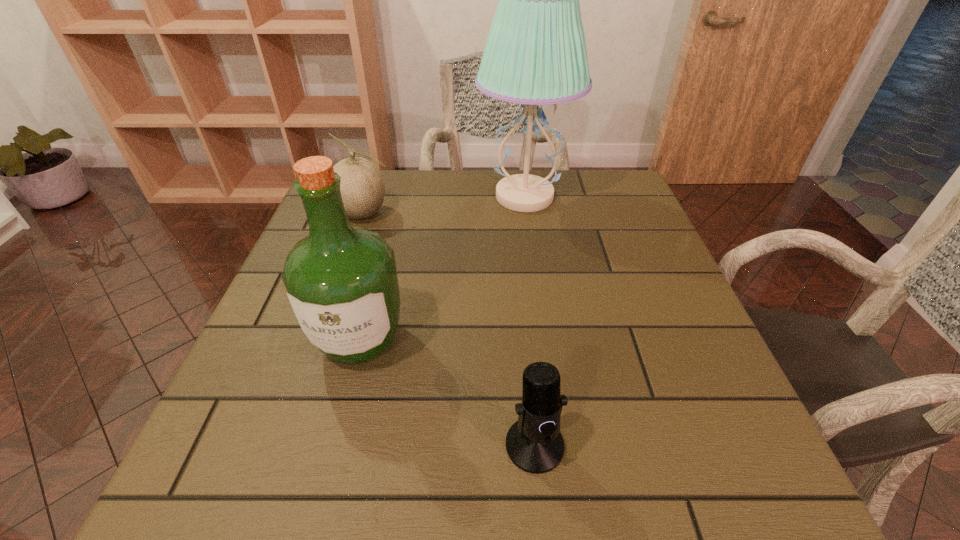
Identify the location of object that is at the near edge. (534, 444).

This screenshot has height=540, width=960. In order to click on liquor located in the left edge section of the desktop in this screenshot , I will do `click(341, 280)`.

This screenshot has height=540, width=960. Find the location of `cantaloup situated at the left edge`. cantaloup situated at the left edge is located at coordinates (x=362, y=186).

Where is `object that is at the far left corner`? object that is at the far left corner is located at coordinates (362, 186).

Locate an element on the screen. free space at the far edge is located at coordinates (544, 174).

In the image, there is a desktop. At what (x,y) coordinates should I click in order to perform the action: click on vacant space at the near edge. Please return your answer as a coordinate pair (x, y). The height and width of the screenshot is (540, 960). Looking at the image, I should click on (640, 454).

The image size is (960, 540). In the image, there is a desktop. What are the coordinates of `blank space at the left edge` in the screenshot? It's located at (310, 374).

Where is `free space at the right edge of the desktop`? The image size is (960, 540). free space at the right edge of the desktop is located at coordinates (588, 235).

The image size is (960, 540). I want to click on free space at the far right corner of the desktop, so click(619, 171).

What are the coordinates of `vacant area at the near right corner` in the screenshot? It's located at (732, 486).